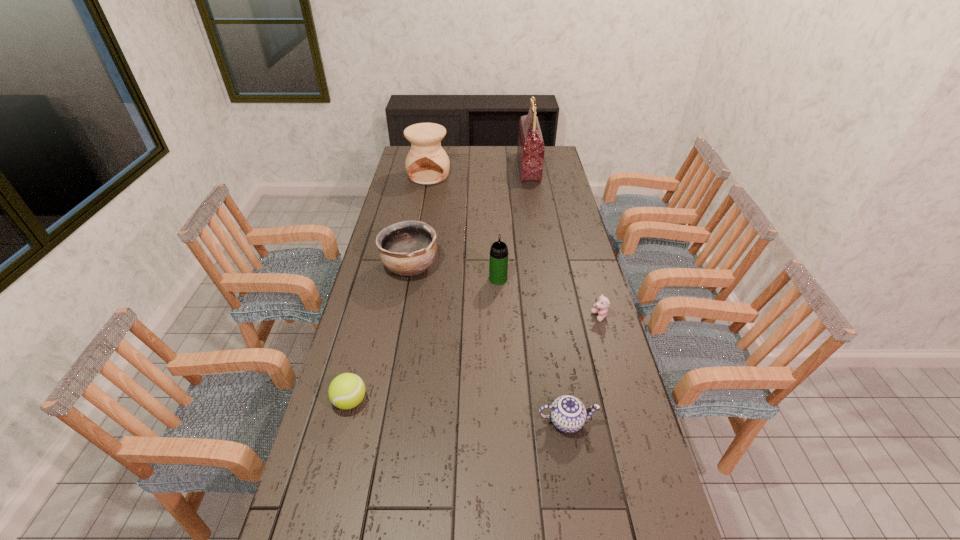
I want to click on the rightmost object, so click(601, 307).

At what (x,y) coordinates should I click in order to perform the action: click on free space located 0.390m on the front-facing side of the handbag. Please return your answer as a coordinate pair (x, y). The height and width of the screenshot is (540, 960). Looking at the image, I should click on (446, 167).

Identify the location of vacant region located 0.050m on the front-facing side of the handbag. (510, 167).

Where is `vacant region located 0.280m on the front-facing side of the handbag`? The height and width of the screenshot is (540, 960). vacant region located 0.280m on the front-facing side of the handbag is located at coordinates (468, 167).

Where is `vacant space situated 0.100m at the open side of the taller pottery`? This screenshot has width=960, height=540. vacant space situated 0.100m at the open side of the taller pottery is located at coordinates (425, 196).

Find the location of `vacant space positioned 0.400m from the spout of the thermos bottle`. vacant space positioned 0.400m from the spout of the thermos bottle is located at coordinates click(x=495, y=217).

Identify the location of vacant space situated from the spout of the thermos bottle. (496, 241).

In order to click on free space located from the spout of the thermos bottle in this screenshot , I will do `click(496, 234)`.

The image size is (960, 540). In order to click on vacant region located on the front of the fourth tallest object in this screenshot , I will do `click(396, 348)`.

Where is `vacant area located 0.360m on the right of the tennis ball`? vacant area located 0.360m on the right of the tennis ball is located at coordinates pyautogui.click(x=492, y=401).